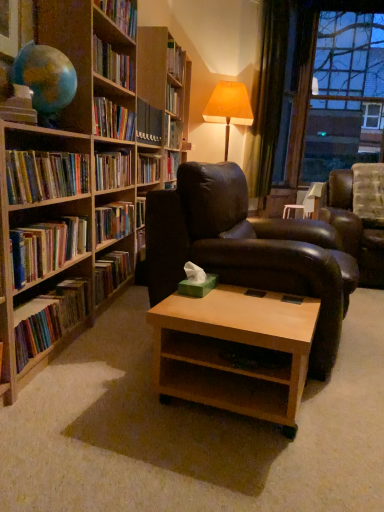
Question: Is wooden bookshelf at center to the left or to the right of green velvet curtain at upper right in the image?

Choices:
 (A) right
 (B) left

Answer: (B)

Question: Considering the positions of wooden bookshelf at center and green velvet curtain at upper right in the image, is wooden bookshelf at center wider or thinner than green velvet curtain at upper right?

Choices:
 (A) thin
 (B) wide

Answer: (B)

Question: Which is farther from the light brown wood coffee table at center?

Choices:
 (A) leather couch at right
 (B) leather armchair at center
 (C) wooden bookcase at left
 (D) wooden bookshelf at center
 (E) hardcover books at left, arranged as the second book when ordered from the bottom

Answer: (A)

Question: Which of these objects is positioned closest to the hardcover books at left, the 1th book when ordered from top to bottom?

Choices:
 (A) transparent glass window at upper right
 (B) light brown wood coffee table at center
 (C) matte beige table lamp at upper right
 (D) multicolored paperbacks at left, placed as the 3th book when sorted from top to bottom
 (E) leather couch at right

Answer: (D)